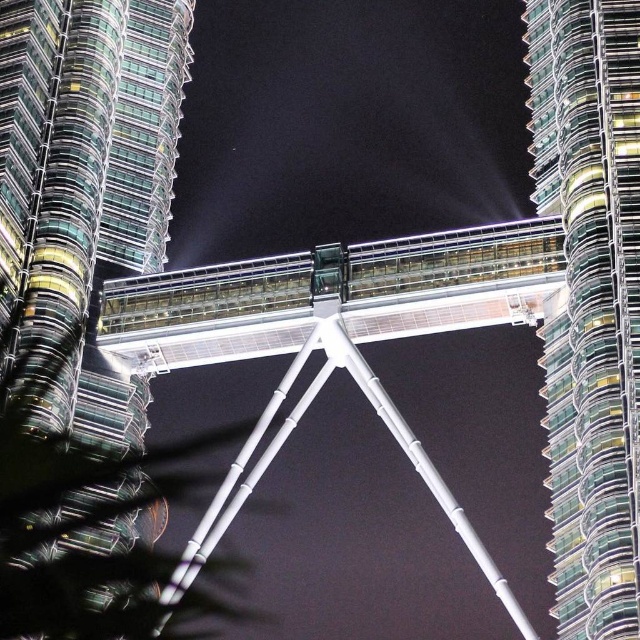
Question: Which of the following is the farthest from the observer?

Choices:
 (A) (104, 380)
 (B) (595, 166)

Answer: (A)

Question: Which object is the farthest from the transparent glass tower at center?

Choices:
 (A) white metallic suspension bridge at center
 (B) glassy steel skyscraper at center

Answer: (B)

Question: Can you confirm if transparent glass tower at center is bigger than glassy steel skyscraper at center?

Choices:
 (A) no
 (B) yes

Answer: (B)

Question: Considering the relative positions of transparent glass tower at center and white metallic suspension bridge at center in the image provided, where is transparent glass tower at center located with respect to white metallic suspension bridge at center?

Choices:
 (A) left
 (B) right

Answer: (A)

Question: Does glassy steel skyscraper at center appear over white metallic suspension bridge at center?

Choices:
 (A) yes
 (B) no

Answer: (A)

Question: Among these objects, which one is nearest to the camera?

Choices:
 (A) glassy steel skyscraper at center
 (B) transparent glass tower at center
 (C) white metallic suspension bridge at center

Answer: (B)